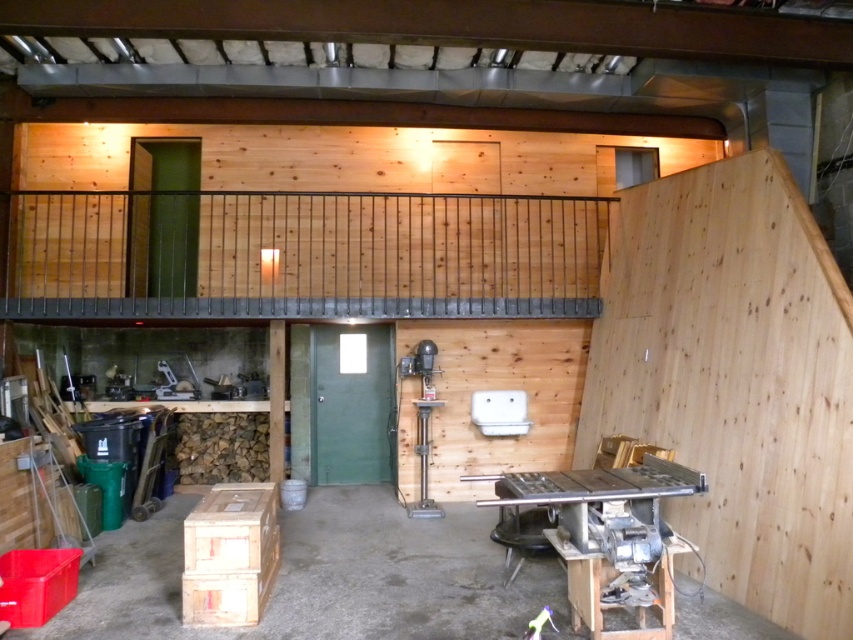
Question: Does wooden crate at lower left come in front of metallic gray table at lower right?

Choices:
 (A) yes
 (B) no

Answer: (B)

Question: Among these points, which one is nearest to the camera?

Choices:
 (A) (395, 532)
 (B) (515, 486)

Answer: (B)

Question: Can you confirm if wooden crate at lower left is thinner than metallic gray table at lower right?

Choices:
 (A) yes
 (B) no

Answer: (B)

Question: Which of the following is the closest to the observer?

Choices:
 (A) (492, 579)
 (B) (619, 580)

Answer: (B)

Question: Is wooden crate at lower left below metallic gray table at lower right?

Choices:
 (A) no
 (B) yes

Answer: (B)